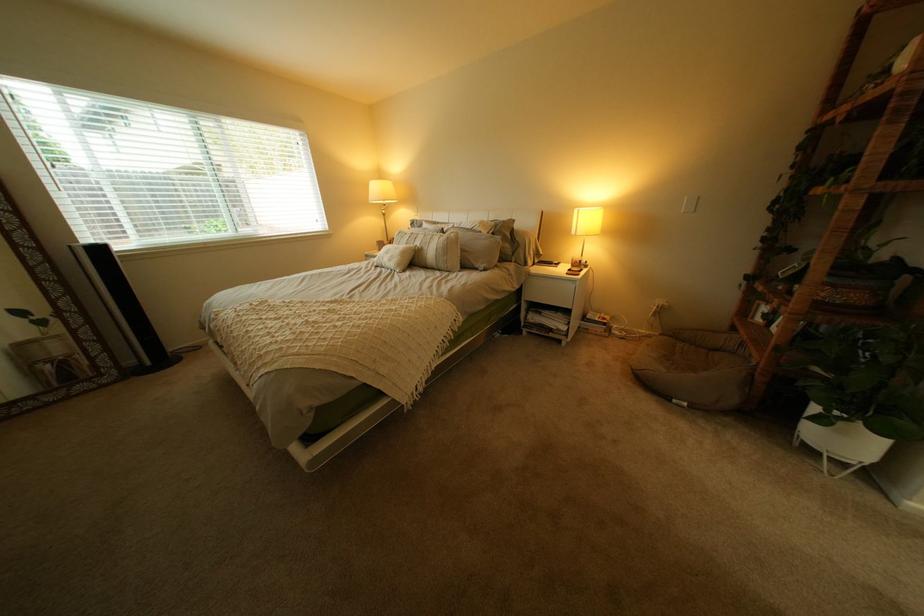
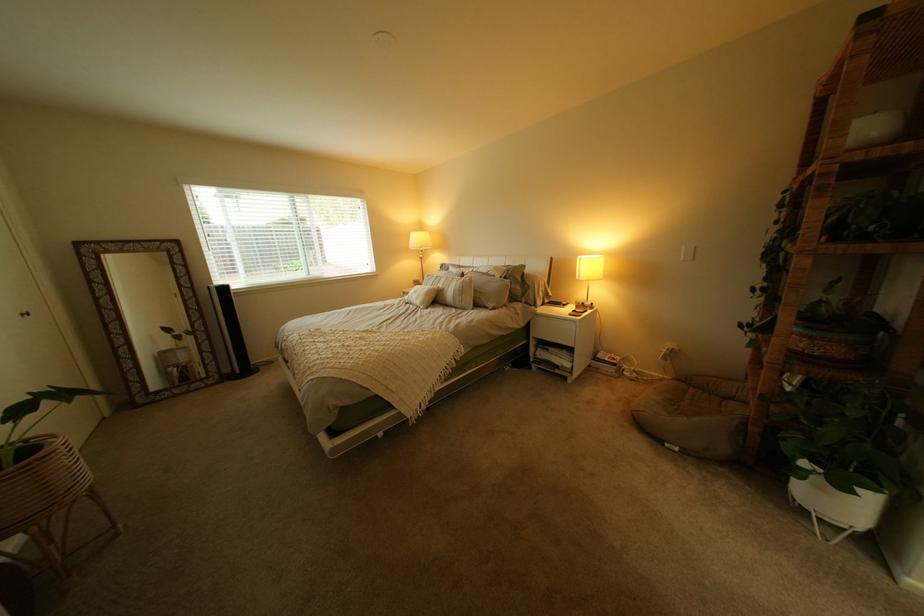
Where in the second image is the point corresponding to point (667, 307) from the first image?

(677, 350)